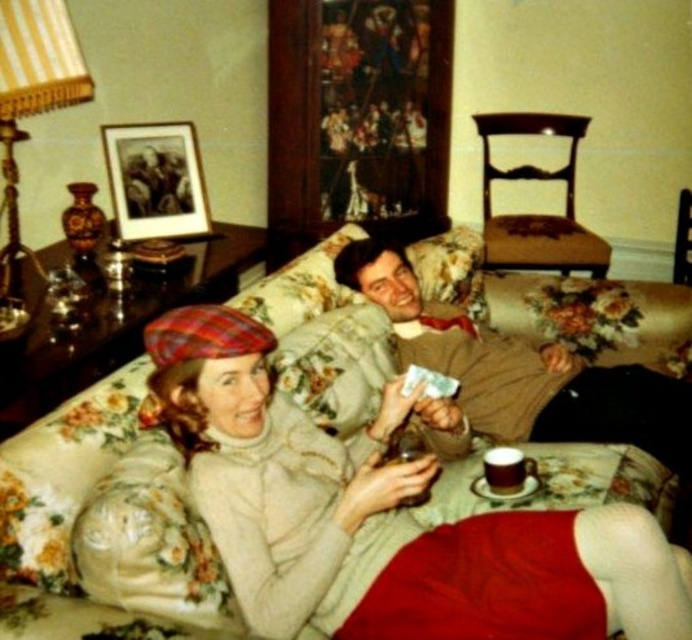
You are planning to rearrange the living room and want to place a new rug. The rug needs to be placed between the floral fabric couch at center and the floral fabric armchair at center. Based on their current positions, which object should be closer to the rug after placement?

The floral fabric couch at center is positioned under the floral fabric armchair at center, so the couch is lower and closer to the ground. Therefore, the rug should be placed closer to the floral fabric couch at center since it is positioned under the armchair.

Looking at this image, you are standing in the living room and want to move from the entrance to the window on the far wall. The entrance is behind the floral fabric couch at center. Which direction should you move relative to the floral fabric armchair at center to reach the window?

Since the floral fabric couch at center is in front of the floral fabric armchair at center, you should move behind the floral fabric armchair at center to reach the window on the far wall.